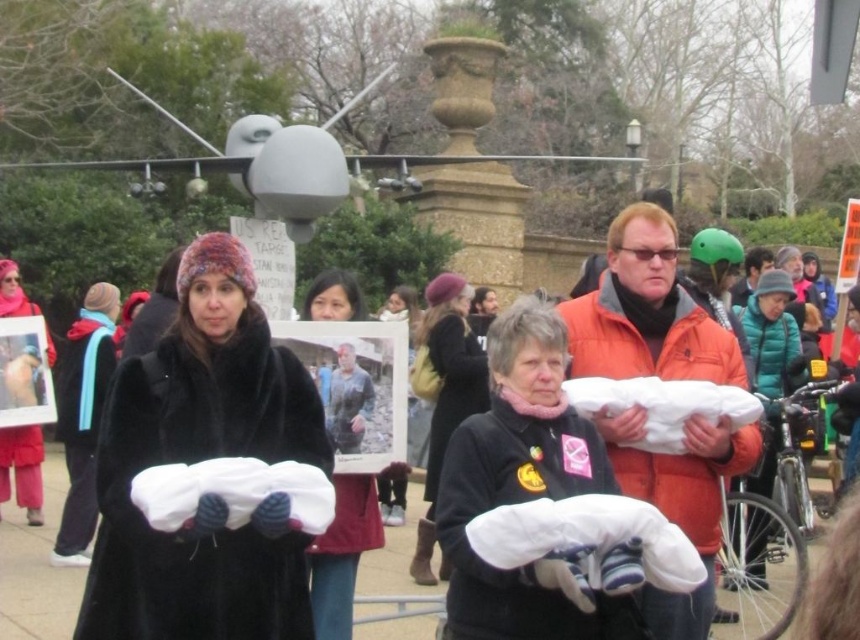
Question: Which of the following is the closest to the observer?

Choices:
 (A) (207, 600)
 (B) (19, 308)
 (C) (363, 308)

Answer: (A)

Question: Which point appears closest to the camera in this image?

Choices:
 (A) (201, 396)
 (B) (444, 326)
 (C) (28, 522)

Answer: (A)

Question: Which of the following is the farthest from the observer?

Choices:
 (A) (339, 291)
 (B) (35, 442)

Answer: (B)

Question: Can you confirm if black fur coat at center is positioned to the left of velvet red coat at center?

Choices:
 (A) yes
 (B) no

Answer: (B)

Question: From the image, what is the correct spatial relationship of white cotton shirt at center in relation to black wool coat at center?

Choices:
 (A) left
 (B) right

Answer: (A)

Question: Is black fur coat at center further to camera compared to black wool coat at center?

Choices:
 (A) no
 (B) yes

Answer: (A)